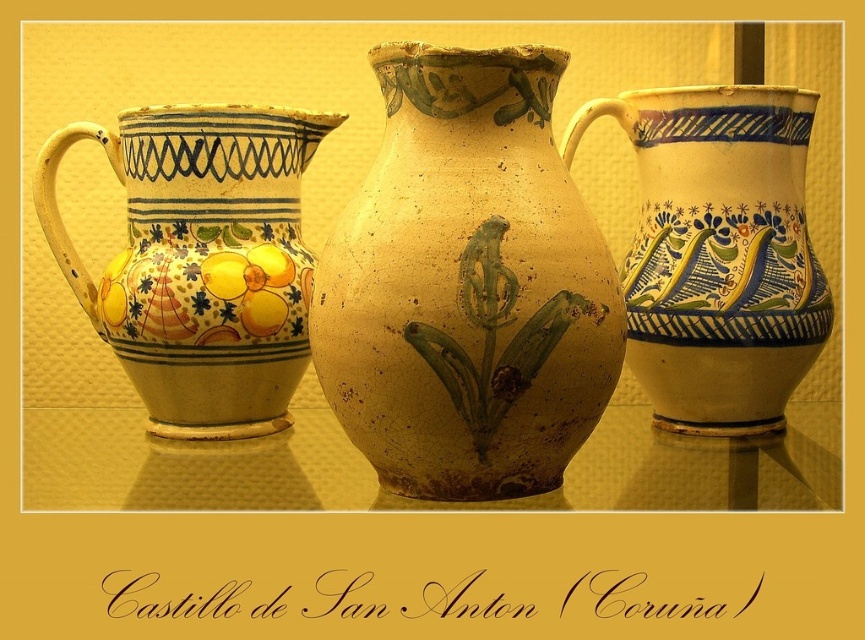
You are arranging these pitchers on a shelf. The matte ceramic jug at left and the matte yellow jug at center are both to be placed side by side. Which one should you place first to ensure they are arranged from shortest to tallest?

The matte ceramic jug at left is shorter than the matte yellow jug at center, so you should place the matte ceramic jug at left first to arrange them from shortest to tallest.

You are arranging these pitchers on a shelf that can only hold items up to the size of the matte ceramic jug at left. Can the matte yellow jug at center fit on the same shelf without exceeding the size limit?

The matte ceramic jug at left is bigger than the matte yellow jug at center, so the matte yellow jug at center can fit on the shelf since it is smaller than the size limit.

You are an interior designer arranging these pitchers on a shelf. The earthenware vase at center and the matte ceramic jug at left need to be placed in a way that highlights their size differences. Which pitcher should be placed in front to emphasize its larger size?

The earthenware vase at center should be placed in front of the matte ceramic jug at left because it is larger, allowing its size to stand out more prominently.